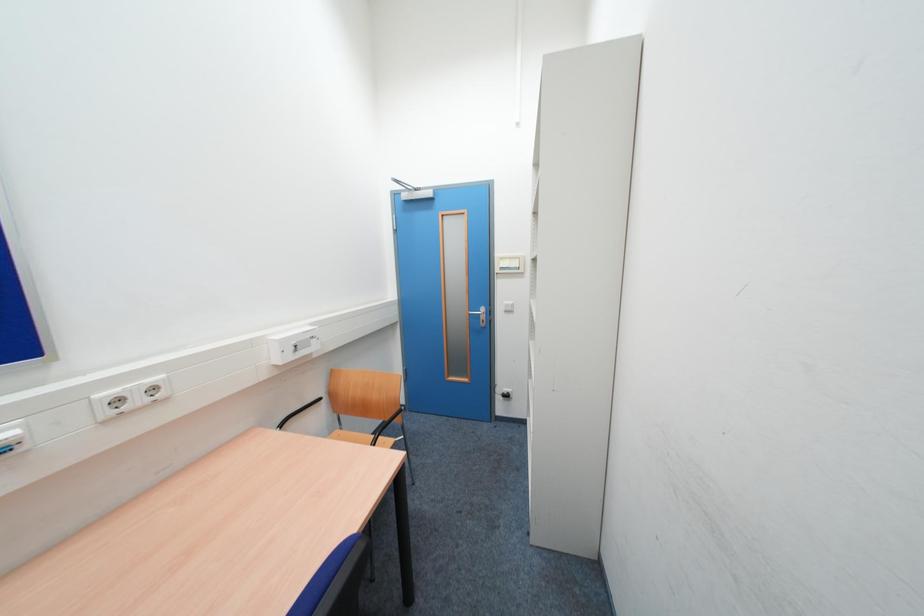
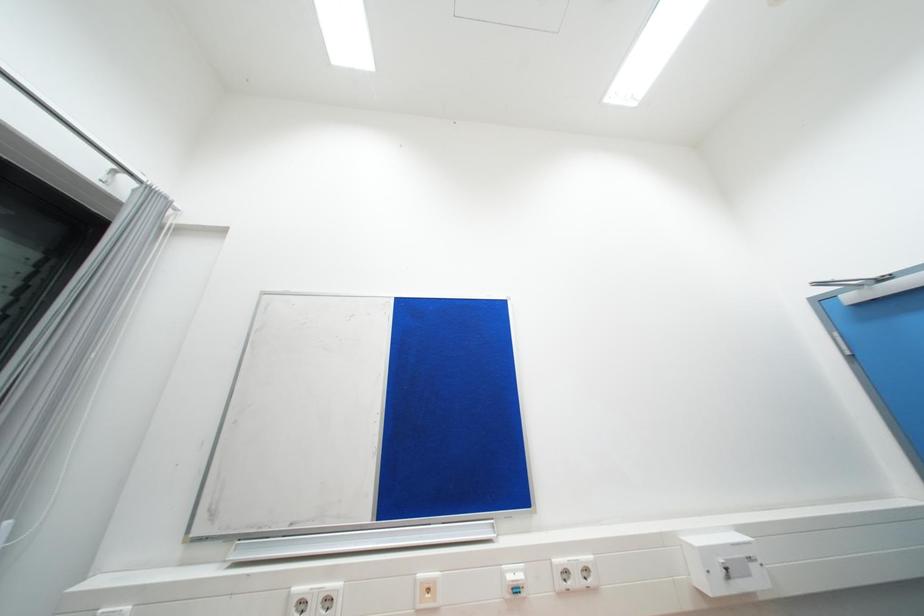
The images are taken continuously from a first-person perspective. In which direction is your viewpoint rotating?

The camera rotated toward left-up.